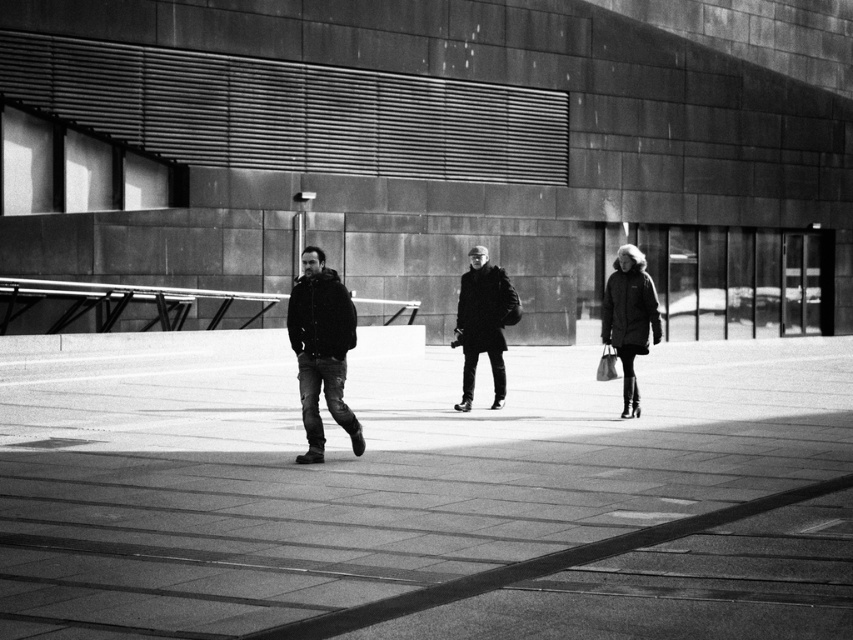
Question: Considering the real-world distances, which object is farthest from the matte black coat at right?

Choices:
 (A) black matte coat at center
 (B) dark gray jeans at center
 (C) smooth concrete pavement at center

Answer: (C)

Question: Which object appears farthest from the camera in this image?

Choices:
 (A) matte black coat at right
 (B) smooth concrete pavement at center

Answer: (A)

Question: Is black matte coat at center above matte black coat at right?

Choices:
 (A) yes
 (B) no

Answer: (A)

Question: Is dark gray jeans at center to the left of black matte coat at center from the viewer's perspective?

Choices:
 (A) yes
 (B) no

Answer: (A)

Question: Which of the following is the closest to the observer?

Choices:
 (A) (310, 320)
 (B) (465, 284)
 (C) (631, 397)
 (D) (616, 529)

Answer: (D)

Question: Is smooth concrete pavement at center thinner than dark gray jeans at center?

Choices:
 (A) yes
 (B) no

Answer: (B)